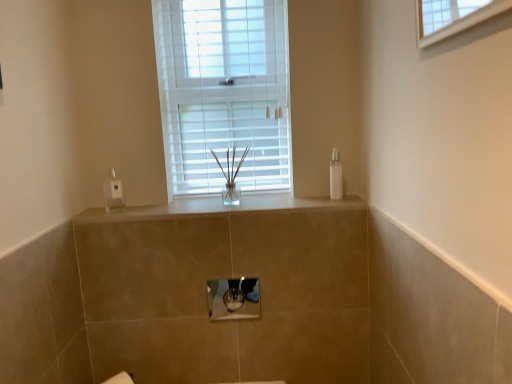
I want to click on vacant space to the right of clear plastic soap dispenser at left, so click(x=137, y=207).